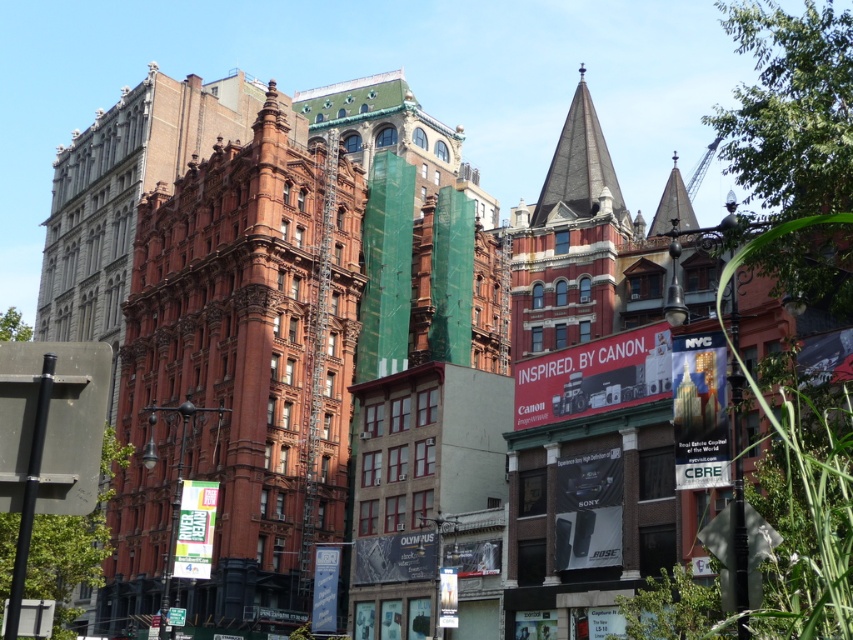
Question: Is red brick building at center to the left of dark gray slate spire at upper center from the viewer's perspective?

Choices:
 (A) no
 (B) yes

Answer: (B)

Question: Does red brick building at center appear over dark gray slate spire at upper center?

Choices:
 (A) yes
 (B) no

Answer: (B)

Question: Which of the following is the farthest from the observer?

Choices:
 (A) (241, 291)
 (B) (538, 195)

Answer: (B)

Question: Among these objects, which one is nearest to the camera?

Choices:
 (A) dark gray slate spire at upper center
 (B) red brick building at center

Answer: (B)

Question: Does red brick building at center appear over dark gray slate spire at upper center?

Choices:
 (A) yes
 (B) no

Answer: (B)